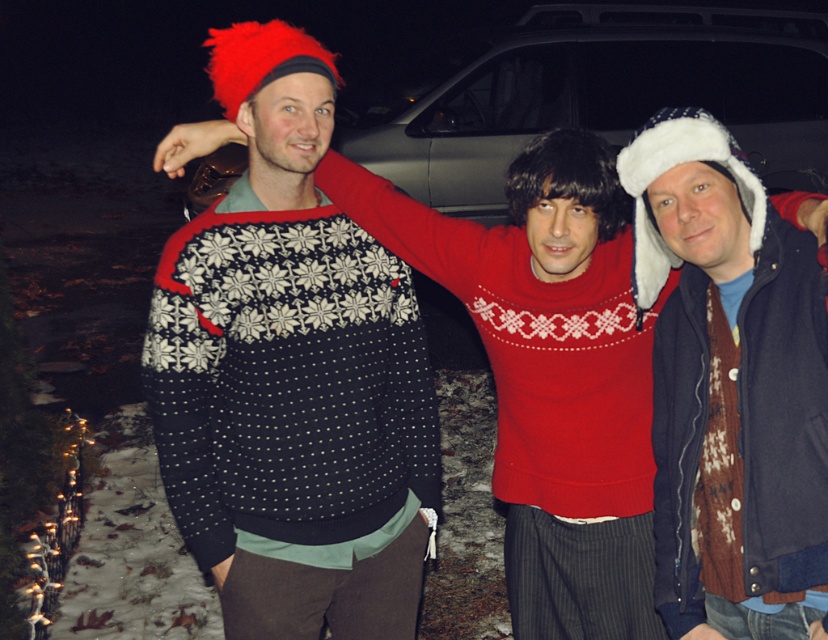
Question: Can you confirm if knitted wool sweater at center is positioned to the right of metallic silver car at center?

Choices:
 (A) no
 (B) yes

Answer: (B)

Question: Can you confirm if knitted wool sweater at center is thinner than metallic silver car at center?

Choices:
 (A) yes
 (B) no

Answer: (A)

Question: Which object is positioned closest to the knitted sweater at center?

Choices:
 (A) knitted wool sweater at center
 (B) metallic silver car at center

Answer: (A)

Question: In this image, where is knitted wool sweater at center located relative to metallic silver car at center?

Choices:
 (A) right
 (B) left

Answer: (A)

Question: Which is nearer to the knitted wool sweater at center?

Choices:
 (A) metallic silver car at center
 (B) knitted sweater at center

Answer: (B)

Question: Which of the following is the farthest from the observer?

Choices:
 (A) knitted sweater at center
 (B) knitted wool sweater at center

Answer: (A)